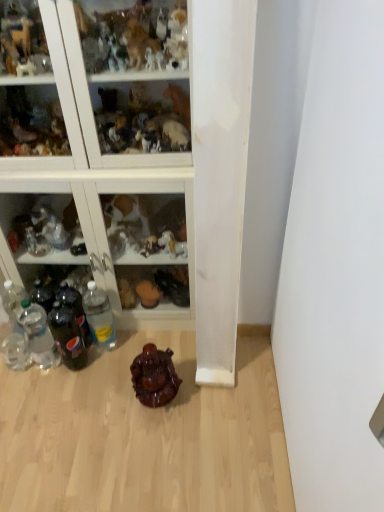
The height and width of the screenshot is (512, 384). What are the coordinates of `blank area to the left of shiny brown statue at center` in the screenshot? It's located at (112, 399).